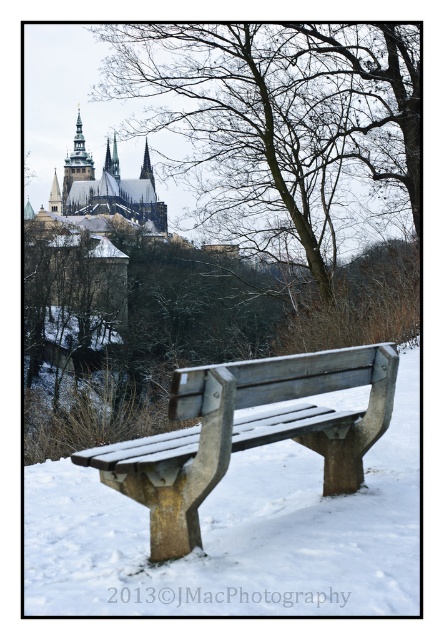
Question: Which point is closer to the camera taking this photo?

Choices:
 (A) (232, 138)
 (B) (137, 212)

Answer: (A)

Question: Which object is positioned farthest from the snow-covered stone castle at upper left?

Choices:
 (A) wooden bench at center
 (B) bare branches at upper center

Answer: (A)

Question: Can you confirm if bare branches at upper center is positioned to the left of wooden bench at center?

Choices:
 (A) yes
 (B) no

Answer: (A)

Question: Is wooden bench at center thinner than snow-covered stone castle at upper left?

Choices:
 (A) yes
 (B) no

Answer: (A)

Question: Is wooden bench at center above snow-covered stone castle at upper left?

Choices:
 (A) yes
 (B) no

Answer: (B)

Question: Considering the real-world distances, which object is farthest from the wooden bench at center?

Choices:
 (A) snow-covered stone castle at upper left
 (B) bare branches at upper center

Answer: (A)